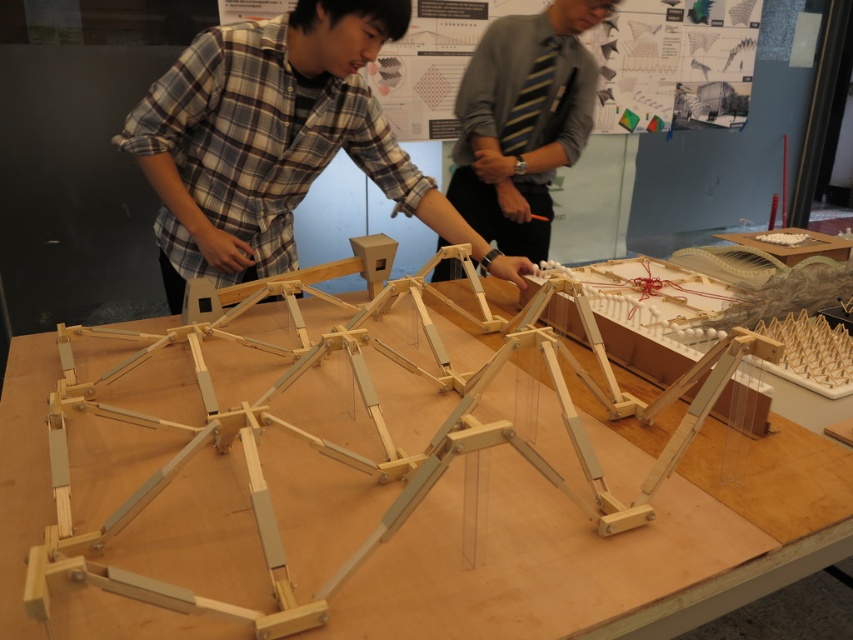
You are standing in front of the table where the wooden frame at center and striped tie at center are visible. Which object is nearer to you?

The wooden frame at center is closer to the viewer than the striped tie at center.

You are a photographer trying to capture a candid shot of both the plaid shirt at center and the striped tie at center in the scene. If you want to ensure both are fully visible in the frame without cropping, which part of the image should you focus on vertically?

The plaid shirt at center is shorter than the striped tie at center, so focusing on the lower half of the image will ensure both are fully visible without cropping.